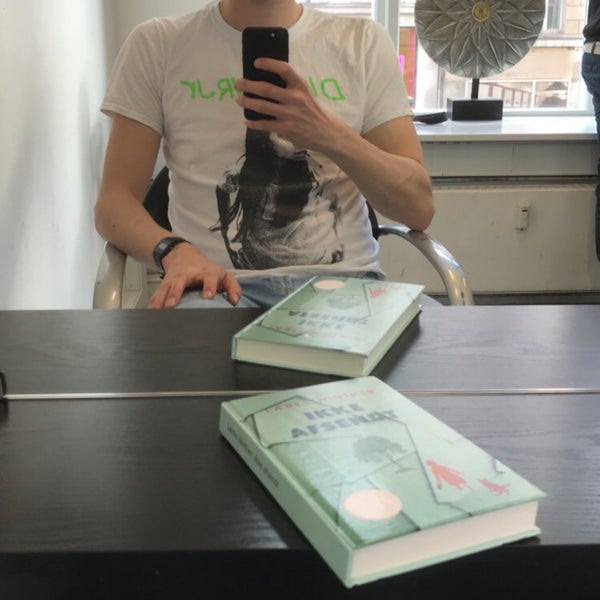
Where is `mirror`? This screenshot has width=600, height=600. mirror is located at coordinates (49, 345), (567, 329), (318, 324), (48, 192), (280, 142), (533, 110), (485, 22), (41, 30).